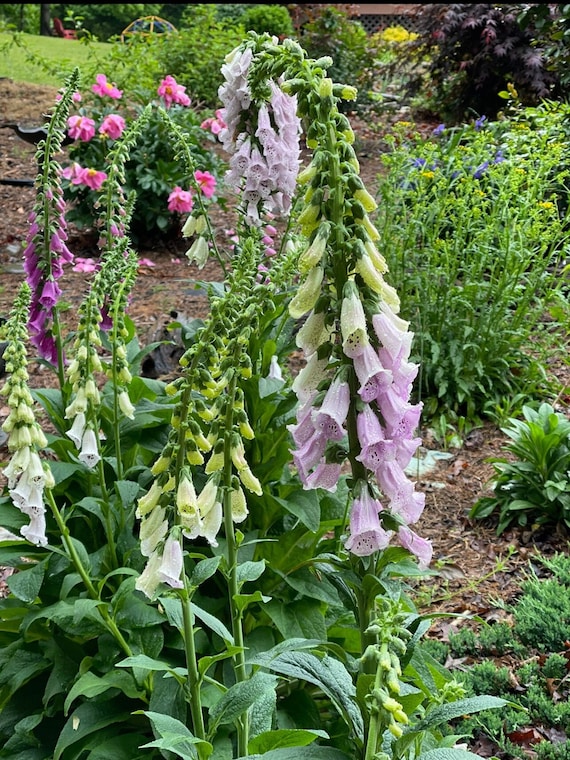
Where is `1 lilac and light yellow set of flowers`? The height and width of the screenshot is (760, 570). 1 lilac and light yellow set of flowers is located at coordinates (374, 415).